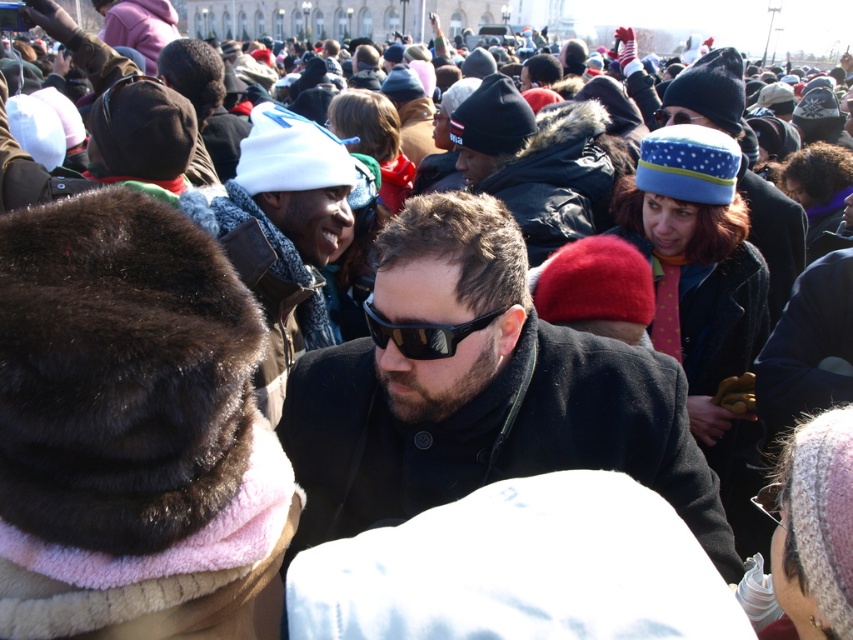
Question: Is black matte coat at center behind black reflective sunglasses at center?

Choices:
 (A) yes
 (B) no

Answer: (B)

Question: Which of these objects is positioned farthest from the white knit hat at upper center?

Choices:
 (A) black matte coat at center
 (B) black reflective sunglasses at center

Answer: (B)

Question: Where is black matte coat at center located in relation to white knit hat at upper center in the image?

Choices:
 (A) below
 (B) above

Answer: (A)

Question: Which is nearer to the white knit hat at upper center?

Choices:
 (A) black matte coat at center
 (B) black reflective sunglasses at center

Answer: (A)

Question: Among these points, which one is farthest from the camera?

Choices:
 (A) (314, 412)
 (B) (267, 285)
 (C) (398, 330)

Answer: (B)

Question: Is black matte coat at center to the right of white knit hat at upper center from the viewer's perspective?

Choices:
 (A) yes
 (B) no

Answer: (A)